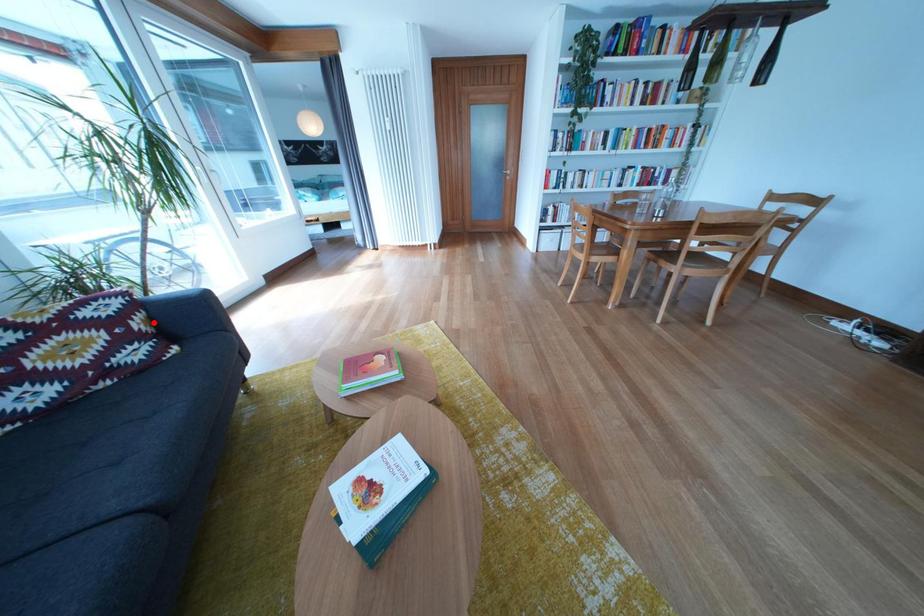
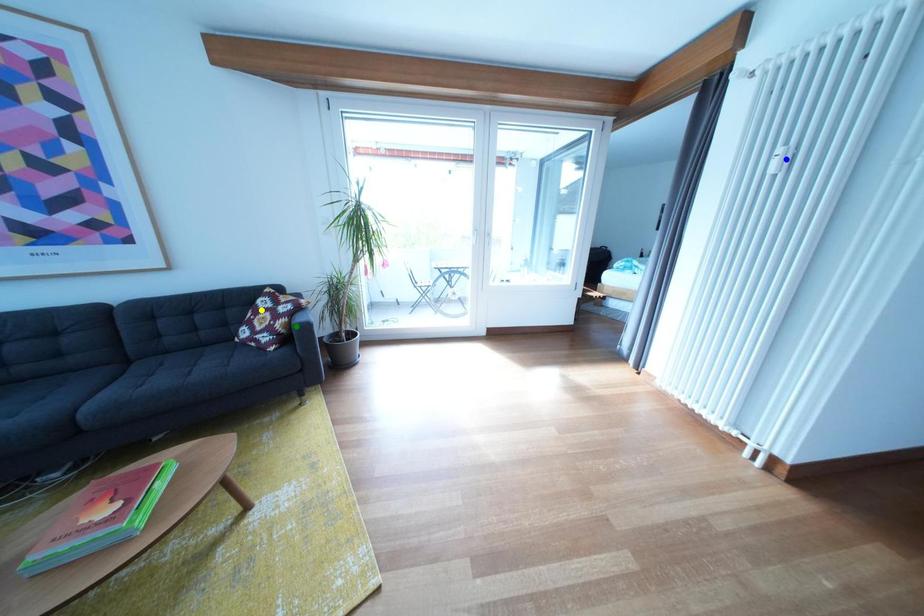
Question: I am providing you with two images of the same scene from different viewpoints. A red point is marked on the first image. You are given multiple points on the second image. Can you choose the point in image 2 that corresponds to the point in image 1?

Choices:
 (A) green point
 (B) blue point
 (C) yellow point

Answer: (A)